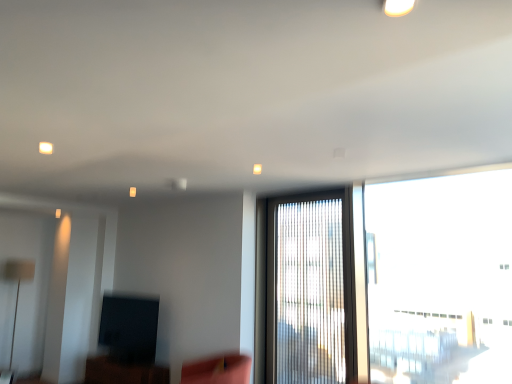
Question: Is translucent glass window at center, which appears as the 1th window when viewed from the left, outside of matte black tv at lower left?

Choices:
 (A) no
 (B) yes

Answer: (B)

Question: From a real-world perspective, is translucent glass window at center, which is counted as the second window, starting from the right, under matte black tv at lower left?

Choices:
 (A) yes
 (B) no

Answer: (B)

Question: Does translucent glass window at center, which appears as the 1th window when viewed from the left, have a smaller size compared to matte black tv at lower left?

Choices:
 (A) yes
 (B) no

Answer: (B)

Question: From the image's perspective, would you say translucent glass window at center, which appears as the 1th window when viewed from the left, is shown under matte black tv at lower left?

Choices:
 (A) no
 (B) yes

Answer: (A)

Question: Is translucent glass window at center, which appears as the 1th window when viewed from the left, at the left side of matte black tv at lower left?

Choices:
 (A) no
 (B) yes

Answer: (A)

Question: Does translucent glass window at center, which appears as the 1th window when viewed from the left, have a greater height compared to matte black tv at lower left?

Choices:
 (A) no
 (B) yes

Answer: (B)

Question: Considering the relative sizes of transparent glass window at right, positioned as the second window in left-to-right order, and matte black tv at lower left in the image provided, is transparent glass window at right, positioned as the second window in left-to-right order, bigger than matte black tv at lower left?

Choices:
 (A) no
 (B) yes

Answer: (B)

Question: Is transparent glass window at right, positioned as the second window in left-to-right order, far away from matte black tv at lower left?

Choices:
 (A) no
 (B) yes

Answer: (B)

Question: Does transparent glass window at right, positioned as the second window in left-to-right order, appear on the right side of matte black tv at lower left?

Choices:
 (A) yes
 (B) no

Answer: (A)

Question: Is transparent glass window at right, the 1th window positioned from the right, with matte black tv at lower left?

Choices:
 (A) no
 (B) yes

Answer: (A)

Question: Can you confirm if transparent glass window at right, the 1th window positioned from the right, is taller than matte black tv at lower left?

Choices:
 (A) yes
 (B) no

Answer: (A)

Question: Is transparent glass window at right, positioned as the second window in left-to-right order, to the left of matte black tv at lower left from the viewer's perspective?

Choices:
 (A) no
 (B) yes

Answer: (A)

Question: Could you tell me if matte black tv at lower left is turned towards white glossy light fixture at upper center?

Choices:
 (A) yes
 (B) no

Answer: (B)